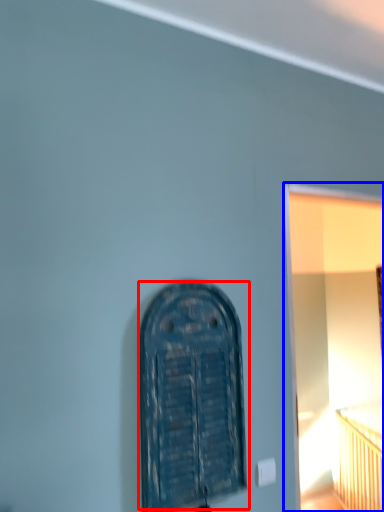
Question: Which object appears farthest to the camera in this image, door (highlighted by a red box) or window frame (highlighted by a blue box)?

Choices:
 (A) door
 (B) window frame

Answer: (B)